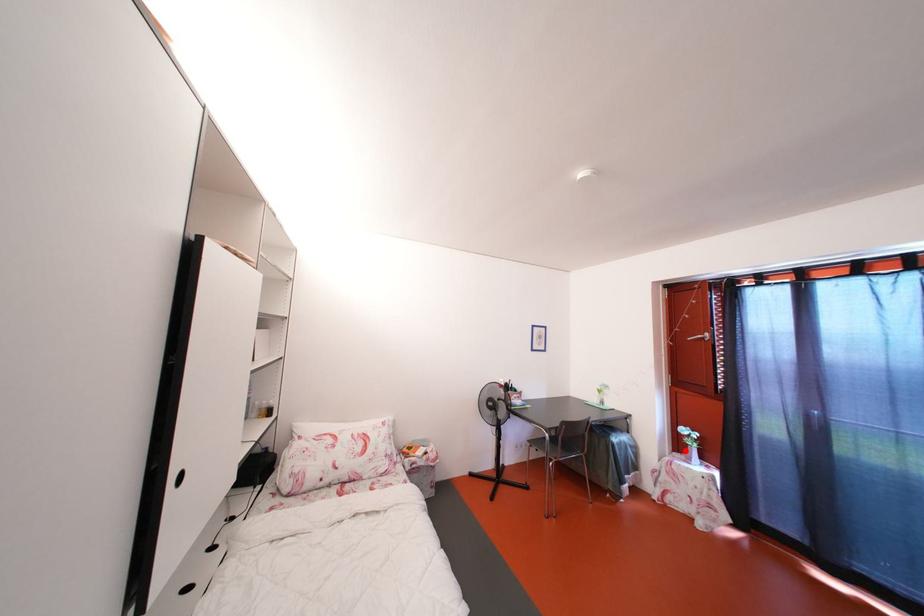
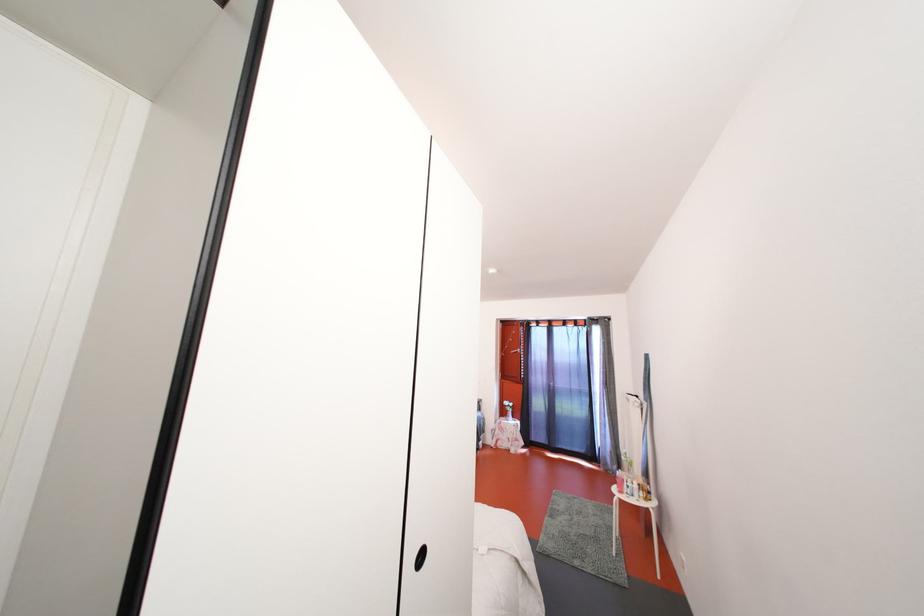
Question: I am providing you with two images of the same scene from different viewpoints. Image1 has a red point marked. In image2, the corresponding 3D location appears at what relative position? Reply with the corresponding letter.

Choices:
 (A) Closer
 (B) Farther

Answer: (B)